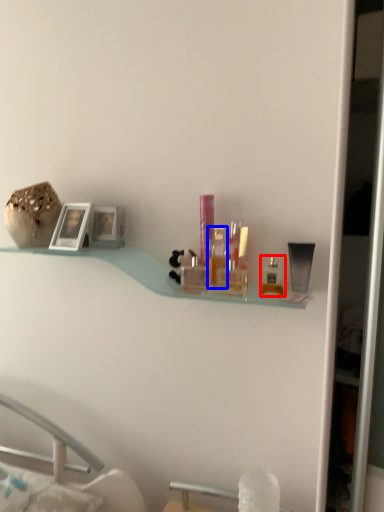
Question: Which object is closer to the camera taking this photo, toiletry (highlighted by a red box) or toiletry (highlighted by a blue box)?

Choices:
 (A) toiletry
 (B) toiletry

Answer: (A)